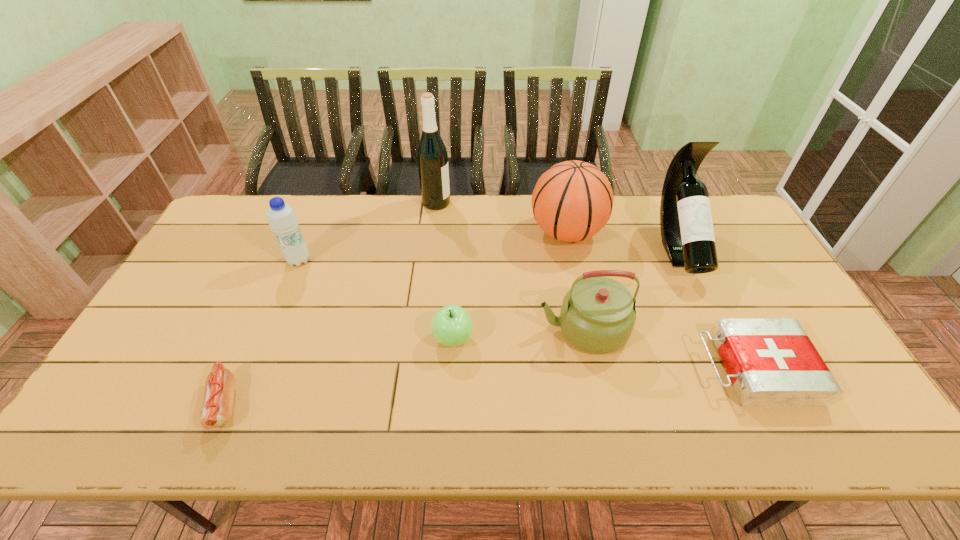
Image resolution: width=960 pixels, height=540 pixels. I want to click on blank space located on the label of the farther wine bottle, so click(x=484, y=202).

Locate an element on the screen. free space located on the stand of the right wine bottle is located at coordinates (732, 366).

Identify the location of free spot located 0.350m on the left of the basketball. The width and height of the screenshot is (960, 540). (423, 233).

Where is `free space located 0.280m on the front of the water bottle`? free space located 0.280m on the front of the water bottle is located at coordinates (264, 345).

In order to click on vacant region located 0.180m at the spout of the kettle in this screenshot , I will do pyautogui.click(x=470, y=329).

This screenshot has width=960, height=540. Identify the location of vacant space located 0.170m at the spout of the kettle. (474, 329).

Find the location of a particular element. The image size is (960, 540). free region located at the spout of the kettle is located at coordinates (452, 329).

The height and width of the screenshot is (540, 960). In order to click on vacant area located 0.260m on the left of the apple in this screenshot , I will do `click(334, 339)`.

The width and height of the screenshot is (960, 540). Identify the location of blank area located on the front side of the first-aid kit. (658, 369).

The height and width of the screenshot is (540, 960). What are the coordinates of `vacant region located 0.050m on the front side of the first-aid kit` in the screenshot? It's located at (682, 369).